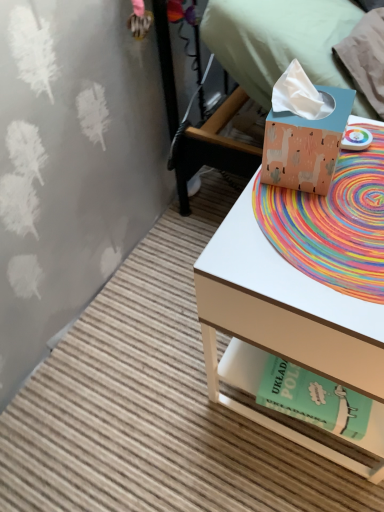
Locate an element on the screen. This screenshot has height=512, width=384. free region under rainbow woven mat at center (from a real-world perspective) is located at coordinates (340, 209).